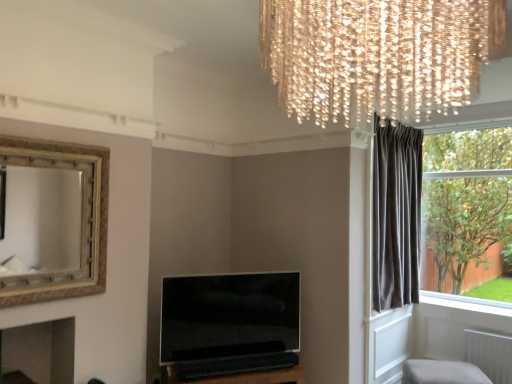
Question: Is point (472, 36) closer or farther from the camera than point (172, 299)?

Choices:
 (A) closer
 (B) farther

Answer: (A)

Question: From a real-world perspective, is crystal chandelier at upper center physically located above or below flat-screen tv at center?

Choices:
 (A) below
 (B) above

Answer: (B)

Question: Estimate the real-world distances between objects in this image. Which object is farther from the dark velvet curtain at right?

Choices:
 (A) crystal chandelier at upper center
 (B) flat-screen tv at center
 (C) gold textured mirror at upper left
 (D) light beige fabric ottoman at lower right

Answer: (A)

Question: Which object is positioned closest to the flat-screen tv at center?

Choices:
 (A) gold textured mirror at upper left
 (B) light beige fabric ottoman at lower right
 (C) dark velvet curtain at right
 (D) crystal chandelier at upper center

Answer: (A)